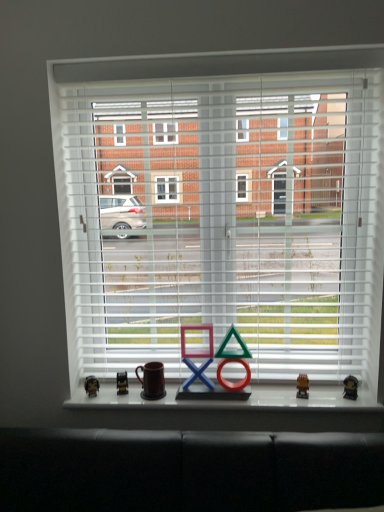
Question: From a real-world perspective, is metallic gold figurine at right, the fourth miniature in the left-to-right sequence, above or below matte plastic game piece at center?

Choices:
 (A) below
 (B) above

Answer: (A)

Question: Relative to matte plastic game piece at center, is metallic gold figurine at right, the fourth miniature in the left-to-right sequence, in front or behind?

Choices:
 (A) front
 (B) behind

Answer: (B)

Question: Which object is positioned farthest from the brown matte mug at center?

Choices:
 (A) metallic gold figurine at right, the fourth miniature in the left-to-right sequence
 (B) metallic silver figurine at lower left, the first miniature from the left
 (C) metallic gold miniature at lower left, which appears as the second miniature when viewed from the left
 (D) matte plastic game piece at center
 (E) white matte blinds at center

Answer: (A)

Question: Estimate the real-world distances between objects in this image. Which object is closer to the white matte blinds at center?

Choices:
 (A) brown matte mug at center
 (B) metallic gold figurine at center, acting as the 3th miniature starting from the left
 (C) metallic silver figurine at lower left, the first miniature from the left
 (D) matte plastic game piece at center
 (E) metallic gold miniature at lower left, which appears as the 3th miniature when viewed from the right

Answer: (D)